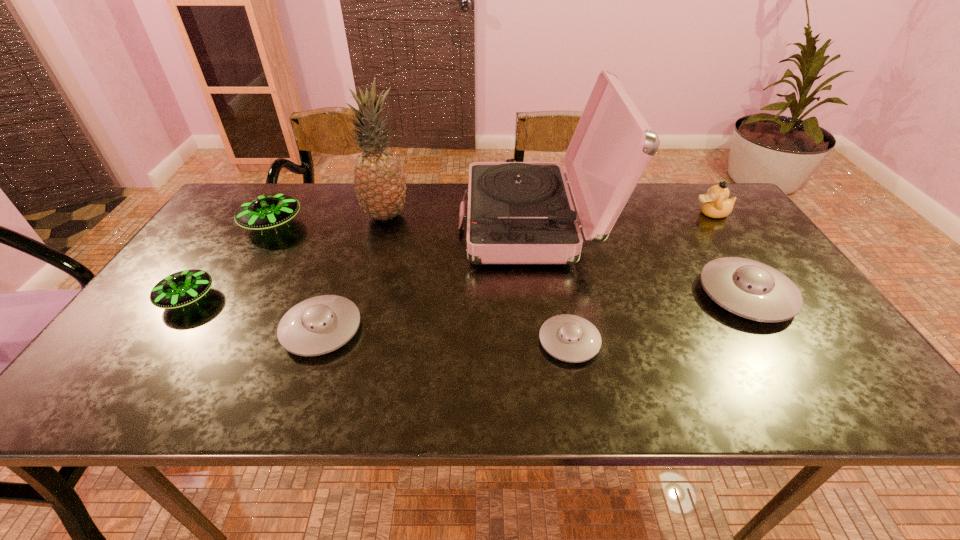
You are a GUI agent. You are given a task and a screenshot of the screen. Output one action in this format:
    pyautogui.click(x=<x>, y=<y>)
    Task: Click on the pineapple
    The height and width of the screenshot is (540, 960).
    Given the screenshot: What is the action you would take?
    pyautogui.click(x=379, y=180)

Where is `record player`? Image resolution: width=960 pixels, height=540 pixels. record player is located at coordinates (518, 212).

The width and height of the screenshot is (960, 540). I want to click on tan duckling, so tap(716, 204).

In order to click on duckling in this screenshot , I will do `click(716, 204)`.

You are a GUI agent. You are given a task and a screenshot of the screen. Output one action in this format:
    pyautogui.click(x=<x>, y=<y>)
    Task: Click on the farthest saucer
    
    Given the screenshot: What is the action you would take?
    pyautogui.click(x=268, y=211)

What are the coordinates of `the bigger green saucer` in the screenshot? It's located at (268, 211).

This screenshot has width=960, height=540. In order to click on the biggest gray saucer in this screenshot , I will do `click(748, 288)`.

Locate an element on the screen. This screenshot has height=540, width=960. the rightmost saucer is located at coordinates (748, 288).

In order to click on the nearer green saucer in this screenshot , I will do `click(182, 288)`.

Identify the location of the leftmost gray saucer. Image resolution: width=960 pixels, height=540 pixels. (318, 325).